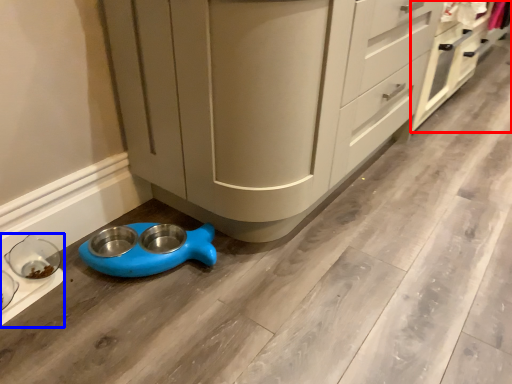
Question: Which of the following is the farthest to the observer, cabinetry (highlighted by a red box) or appliance (highlighted by a blue box)?

Choices:
 (A) cabinetry
 (B) appliance

Answer: (A)